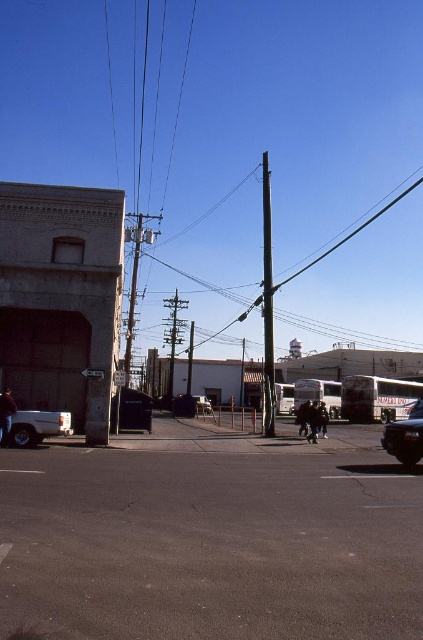
You are a delivery driver who needs to park your truck in the dark asphalt parking lot at lower left. However, there is a smooth black pole at center nearby. Considering their sizes, will the parking lot be large enough to accommodate your truck?

The dark asphalt parking lot at lower left is smaller than the smooth black pole at center, so it might not be large enough to accommodate your truck.

You are a delivery driver approaching the street and need to park your metallic silver car at center near the dark asphalt parking lot at lower left. Can you estimate if the parking lot will be tall enough to accommodate your car?

The dark asphalt parking lot at lower left is not as tall as the metallic silver car at center, so it will not be tall enough to accommodate the car.